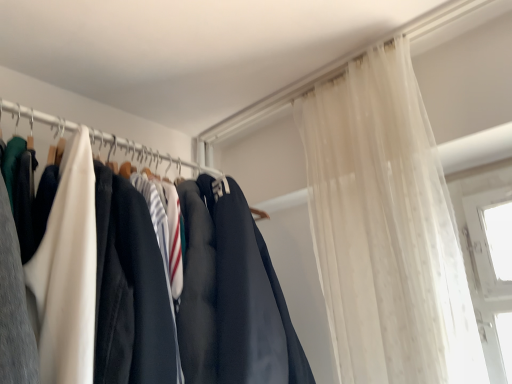
Question: In the image, is sheer white curtain at upper right on the left side or the right side of matte black clothing at left?

Choices:
 (A) right
 (B) left

Answer: (A)

Question: Is point (350, 269) positioned closer to the camera than point (203, 170)?

Choices:
 (A) farther
 (B) closer

Answer: (B)

Question: Is sheer white curtain at upper right in front of or behind matte black clothing at left in the image?

Choices:
 (A) behind
 (B) front

Answer: (B)

Question: Based on their sizes in the image, would you say matte black clothing at left is bigger or smaller than sheer white curtain at upper right?

Choices:
 (A) big
 (B) small

Answer: (B)

Question: From a real-world perspective, is matte black clothing at left physically located above or below sheer white curtain at upper right?

Choices:
 (A) below
 (B) above

Answer: (B)

Question: Does point (18, 117) appear closer or farther from the camera than point (391, 86)?

Choices:
 (A) closer
 (B) farther

Answer: (A)

Question: Is matte black clothing at left to the left or to the right of sheer white curtain at upper right in the image?

Choices:
 (A) left
 (B) right

Answer: (A)